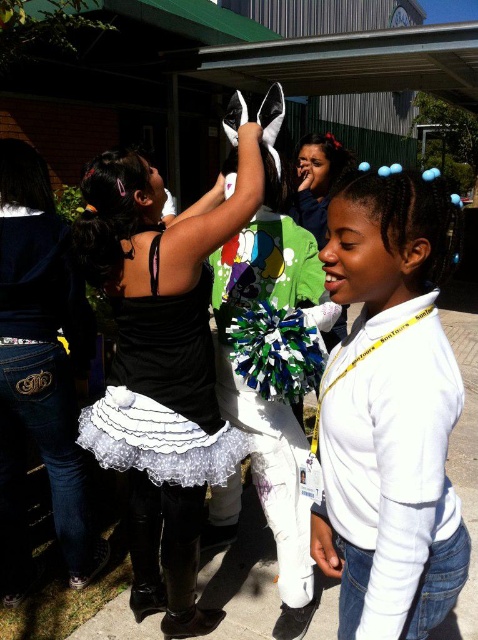
You are a photographer standing at the camera position. You want to take a closeup shot of the white matte hairband at upper right. Can you estimate how far you need to move forward or backward to get the shot?

The white matte hairband at upper right is 96.93 centimeters away from the camera. To take a closeup shot, you would need to move forward by approximately 96.93 centimeters to get closer to the hairband.

Consider the image. You are a photographer trying to capture a photo of the black satin tutu at center and the white lace dress at center. Based on their heights, which one should you focus on first if you want to ensure both are in frame without needing to adjust your camera angle?

The black satin tutu at center is much taller than the white lace dress at center, so you should focus on the black satin tutu at center first to ensure it fits within the frame.

In the scene shown: You are a photographer positioned at the front of the scene. You need to capture a clear shot of both the white matte hairband at upper right and the black satin tutu at center. Which object should you focus on first to ensure both are in focus?

You should focus on the white matte hairband at upper right first because it is closer to the viewer than the black satin tutu at center, so adjusting focus from near to far will help both objects be in focus.